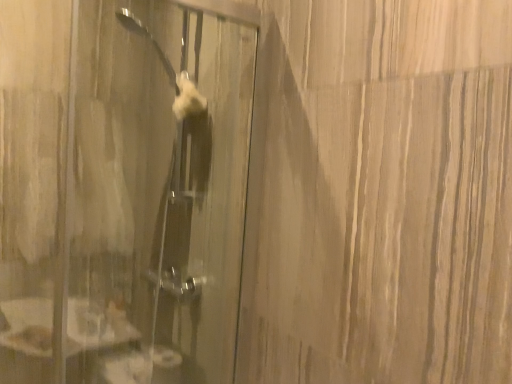
Question: Should I look upward or downward to see transparent glass door at center?

Choices:
 (A) down
 (B) up

Answer: (A)